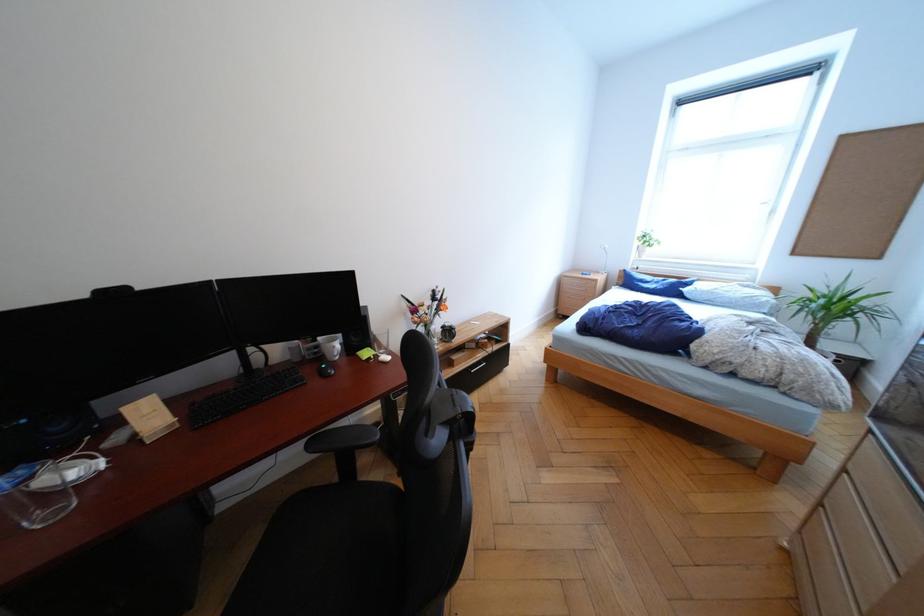
Where would you pull the black drawer handle? Please return your answer as a coordinate pair (x, y).

(477, 367)